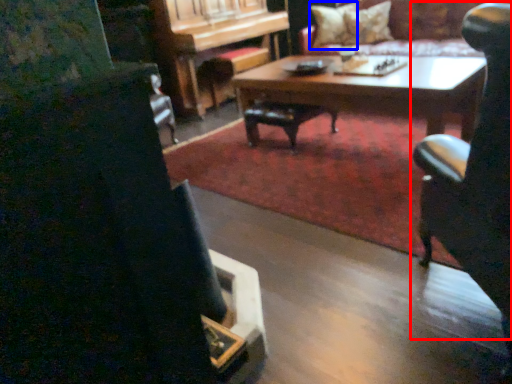
Question: Which object appears closest to the camera in this image, chair (highlighted by a red box) or pillow (highlighted by a blue box)?

Choices:
 (A) chair
 (B) pillow

Answer: (A)